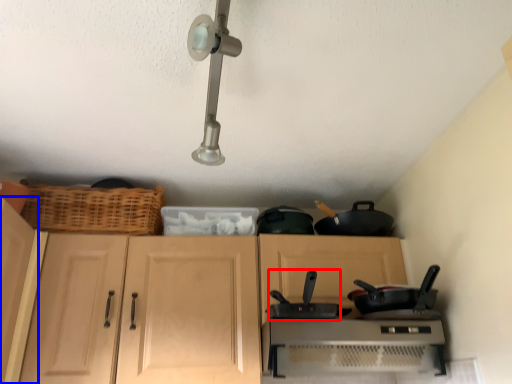
Question: Among these objects, which one is farthest to the camera, wok (highlighted by a red box) or cabinetry (highlighted by a blue box)?

Choices:
 (A) wok
 (B) cabinetry

Answer: (A)